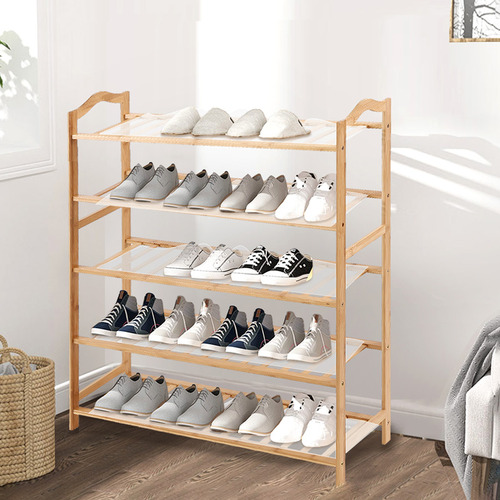
Find the location of a particular element. The width and height of the screenshot is (500, 500). shelves is located at coordinates (355, 418), (347, 346), (327, 282), (351, 201), (315, 134).